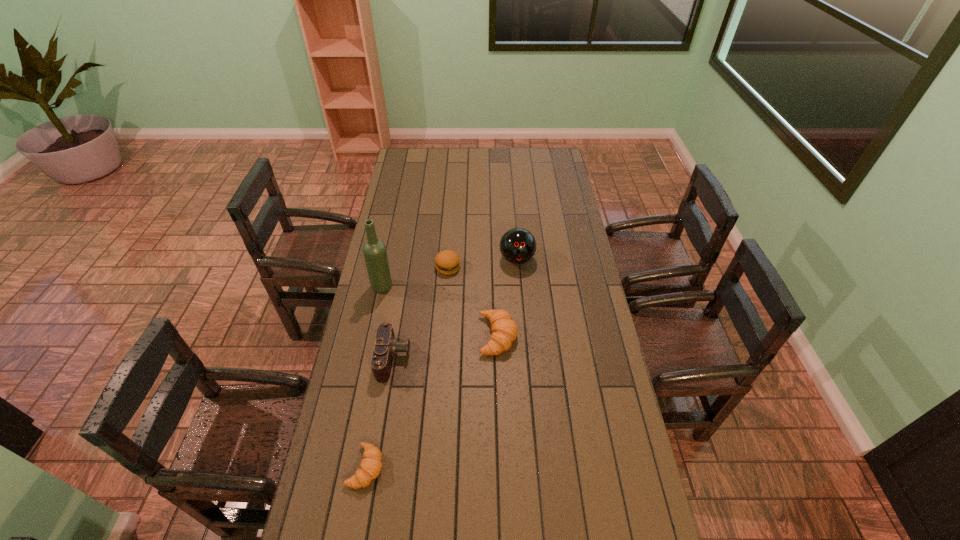
Locate an element on the screen. vacant point located between the fourth shortest object and the bowling ball is located at coordinates (456, 309).

You are a GUI agent. You are given a task and a screenshot of the screen. Output one action in this format:
    pyautogui.click(x=<x>, y=<y>)
    Task: Click on the object that stands as the third closest to the hamburger
    
    Given the screenshot: What is the action you would take?
    pyautogui.click(x=504, y=330)

Locate which object ranks second in proximity to the fifth shortest object. Please provide its 2D coordinates. Your answer should be formatted as a tuple, i.e. [(x, y)], where the tuple contains the x and y coordinates of a point satisfying the conditions above.

[(504, 330)]

At what (x,y) coordinates should I click in order to perform the action: click on vacant space that satisfies the following two spatial constraints: 1. on the surface of the fifth shortest object near the finger holes; 2. on the front-facing side of the camera. Please return your answer as a coordinate pair (x, y). The image size is (960, 540). Looking at the image, I should click on (525, 359).

At what (x,y) coordinates should I click in order to perform the action: click on free spot that satisfies the following two spatial constraints: 1. on the surface of the bowling ball near the finger holes; 2. on the front-facing side of the fourth shortest object. Please return your answer as a coordinate pair (x, y). The width and height of the screenshot is (960, 540). Looking at the image, I should click on (525, 359).